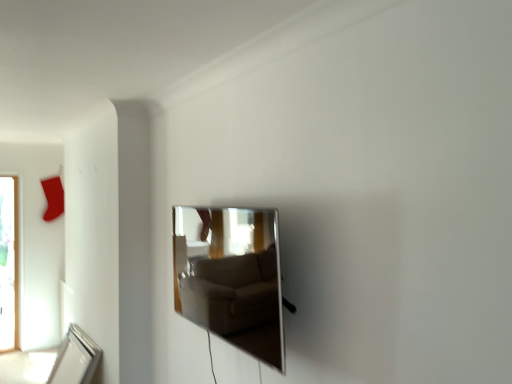
Measure the distance between point [277,361] and camera.

Point [277,361] and camera are 5.39 feet apart.

What do you see at coordinates (231, 277) in the screenshot? The image size is (512, 384). I see `polished silver mirror at center, the 2th mirror positioned from the back` at bounding box center [231, 277].

At what (x,y) coordinates should I click in order to perform the action: click on polished silver mirror at center, the 2th mirror positioned from the back. Please return your answer as a coordinate pair (x, y). The image size is (512, 384). Looking at the image, I should click on (231, 277).

In order to click on silver metallic mirror at lower left, which is the first mirror from back to front in this screenshot , I will do `click(75, 359)`.

Consider the image. Measure the distance between point (70, 381) and camera.

The depth of point (70, 381) is 3.32 meters.

The height and width of the screenshot is (384, 512). Describe the element at coordinates (75, 359) in the screenshot. I see `silver metallic mirror at lower left, which is the second mirror in front-to-back order` at that location.

You are a GUI agent. You are given a task and a screenshot of the screen. Output one action in this format:
    pyautogui.click(x=<x>, y=<y>)
    Task: Click on the polished silver mirror at center, which appears as the 2th mirror when ordered from the bottom
    This screenshot has height=384, width=512.
    Given the screenshot: What is the action you would take?
    pyautogui.click(x=231, y=277)

Does polished silver mirror at center, marked as the 2th mirror in a left-to-right arrangement, appear on the left side of silver metallic mirror at lower left, the first mirror from the bottom?

No.

Considering the positions of objects polished silver mirror at center, marked as the 2th mirror in a left-to-right arrangement, and silver metallic mirror at lower left, marked as the first mirror in a left-to-right arrangement, in the image provided, who is behind, polished silver mirror at center, marked as the 2th mirror in a left-to-right arrangement, or silver metallic mirror at lower left, marked as the first mirror in a left-to-right arrangement,?

silver metallic mirror at lower left, marked as the first mirror in a left-to-right arrangement, is more distant.

Considering the points (180, 232) and (92, 361), which point is behind, point (180, 232) or point (92, 361)?

The point (92, 361) is farther from the camera.

From the image's perspective, which one is positioned lower, polished silver mirror at center, marked as the first mirror in a top-to-bottom arrangement, or silver metallic mirror at lower left, the second mirror when ordered from right to left?

From the image's view, silver metallic mirror at lower left, the second mirror when ordered from right to left, is below.

From a real-world perspective, is polished silver mirror at center, the 2th mirror positioned from the back, positioned under silver metallic mirror at lower left, marked as the first mirror in a left-to-right arrangement, based on gravity?

No, from a real-world perspective, polished silver mirror at center, the 2th mirror positioned from the back, is not beneath silver metallic mirror at lower left, marked as the first mirror in a left-to-right arrangement.

Considering the sizes of objects polished silver mirror at center, marked as the first mirror in a top-to-bottom arrangement, and silver metallic mirror at lower left, the 2th mirror viewed from the top, in the image provided, who is thinner, polished silver mirror at center, marked as the first mirror in a top-to-bottom arrangement, or silver metallic mirror at lower left, the 2th mirror viewed from the top,?

polished silver mirror at center, marked as the first mirror in a top-to-bottom arrangement.

Does polished silver mirror at center, which appears as the 2th mirror when ordered from the bottom, have a greater height compared to silver metallic mirror at lower left, the 2th mirror viewed from the top?

Yes, polished silver mirror at center, which appears as the 2th mirror when ordered from the bottom, is taller than silver metallic mirror at lower left, the 2th mirror viewed from the top.

Between polished silver mirror at center, the 2th mirror positioned from the back, and silver metallic mirror at lower left, which is the second mirror in front-to-back order, which one has larger size?

silver metallic mirror at lower left, which is the second mirror in front-to-back order.

Is polished silver mirror at center, the 2th mirror positioned from the back, inside the boundaries of silver metallic mirror at lower left, which is the first mirror from back to front, or outside?

polished silver mirror at center, the 2th mirror positioned from the back, is not inside silver metallic mirror at lower left, which is the first mirror from back to front, it's outside.

Is the surface of polished silver mirror at center, the 2th mirror positioned from the back, in direct contact with silver metallic mirror at lower left, the first mirror from the bottom?

No, polished silver mirror at center, the 2th mirror positioned from the back, is not with silver metallic mirror at lower left, the first mirror from the bottom.

Looking at this image, is polished silver mirror at center, which appears as the 2th mirror when ordered from the bottom, oriented away from silver metallic mirror at lower left, which is the second mirror in front-to-back order?

No, silver metallic mirror at lower left, which is the second mirror in front-to-back order, is not at the back of polished silver mirror at center, which appears as the 2th mirror when ordered from the bottom.

You are a GUI agent. You are given a task and a screenshot of the screen. Output one action in this format:
    pyautogui.click(x=<x>, y=<y>)
    Task: Click on the mirror behind the polished silver mirror at center, which appears as the 2th mirror when ordered from the bottom
    This screenshot has width=512, height=384.
    Given the screenshot: What is the action you would take?
    pyautogui.click(x=75, y=359)

Considering the relative positions of silver metallic mirror at lower left, which is the first mirror from back to front, and polished silver mirror at center, marked as the first mirror in a top-to-bottom arrangement, in the image provided, is silver metallic mirror at lower left, which is the first mirror from back to front, to the right of polished silver mirror at center, marked as the first mirror in a top-to-bottom arrangement, from the viewer's perspective?

No, silver metallic mirror at lower left, which is the first mirror from back to front, is not to the right of polished silver mirror at center, marked as the first mirror in a top-to-bottom arrangement.

Is the depth of silver metallic mirror at lower left, which is the second mirror in front-to-back order, greater than that of polished silver mirror at center, which is counted as the 1th mirror, starting from the front?

Yes.

Between point (58, 355) and point (188, 216), which one is positioned in front?

Point (188, 216)

From the image's perspective, who appears lower, silver metallic mirror at lower left, the first mirror from the bottom, or polished silver mirror at center, the first mirror positioned from the right?

silver metallic mirror at lower left, the first mirror from the bottom, is shown below in the image.

From a real-world perspective, which is physically below, silver metallic mirror at lower left, which is the first mirror from back to front, or polished silver mirror at center, marked as the 2th mirror in a left-to-right arrangement?

silver metallic mirror at lower left, which is the first mirror from back to front.

In terms of width, does silver metallic mirror at lower left, which is the first mirror from back to front, look wider or thinner when compared to polished silver mirror at center, which appears as the 2th mirror when ordered from the bottom?

Considering their sizes, silver metallic mirror at lower left, which is the first mirror from back to front, looks broader than polished silver mirror at center, which appears as the 2th mirror when ordered from the bottom.

Is silver metallic mirror at lower left, the 2th mirror viewed from the top, taller or shorter than polished silver mirror at center, the first mirror positioned from the right?

silver metallic mirror at lower left, the 2th mirror viewed from the top, is shorter than polished silver mirror at center, the first mirror positioned from the right.

Does silver metallic mirror at lower left, the 2th mirror viewed from the top, have a smaller size compared to polished silver mirror at center, the 2th mirror positioned from the back?

No, silver metallic mirror at lower left, the 2th mirror viewed from the top, is not smaller than polished silver mirror at center, the 2th mirror positioned from the back.

Do you think silver metallic mirror at lower left, marked as the first mirror in a left-to-right arrangement, is within polished silver mirror at center, which is counted as the 1th mirror, starting from the front, or outside of it?

silver metallic mirror at lower left, marked as the first mirror in a left-to-right arrangement, is located beyond the bounds of polished silver mirror at center, which is counted as the 1th mirror, starting from the front.

Looking at this image, are silver metallic mirror at lower left, the second mirror when ordered from right to left, and polished silver mirror at center, the 2th mirror positioned from the back, far apart?

Yes, silver metallic mirror at lower left, the second mirror when ordered from right to left, is far from polished silver mirror at center, the 2th mirror positioned from the back.

Is silver metallic mirror at lower left, which is the second mirror in front-to-back order, positioned with its back to polished silver mirror at center, marked as the first mirror in a top-to-bottom arrangement?

silver metallic mirror at lower left, which is the second mirror in front-to-back order, is not turned away from polished silver mirror at center, marked as the first mirror in a top-to-bottom arrangement.

Can you tell me how much silver metallic mirror at lower left, which is the first mirror from back to front, and polished silver mirror at center, the first mirror positioned from the right, differ in facing direction?

They differ by 0.278 degrees in their facing directions.

Find the location of a particular element. This screenshot has height=384, width=512. mirror that appears on the right of silver metallic mirror at lower left, which is the second mirror in front-to-back order is located at coordinates (231, 277).

Identify the location of mirror behind the polished silver mirror at center, which is counted as the 1th mirror, starting from the front. point(75,359).

Locate an element on the screen. mirror located in front of the silver metallic mirror at lower left, the first mirror from the bottom is located at coordinates (231, 277).